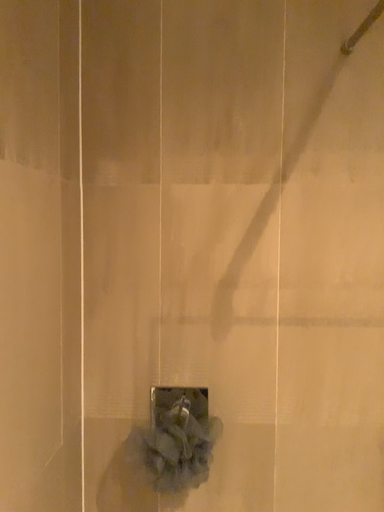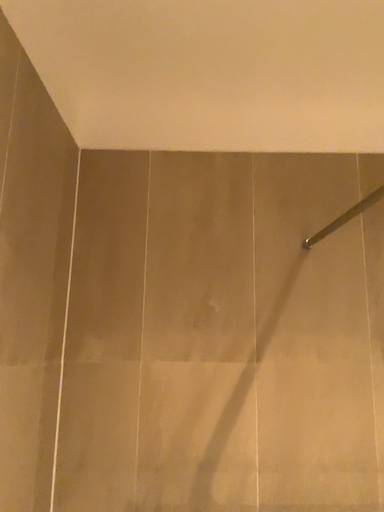
Question: Which way did the camera rotate in the video?

Choices:
 (A) rotated upward
 (B) rotated downward

Answer: (A)